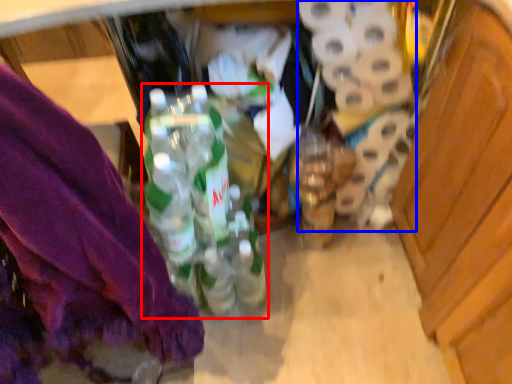
Question: Which of the following is the farthest to the observer, bottle (highlighted by a red box) or toilet paper (highlighted by a blue box)?

Choices:
 (A) bottle
 (B) toilet paper

Answer: (B)